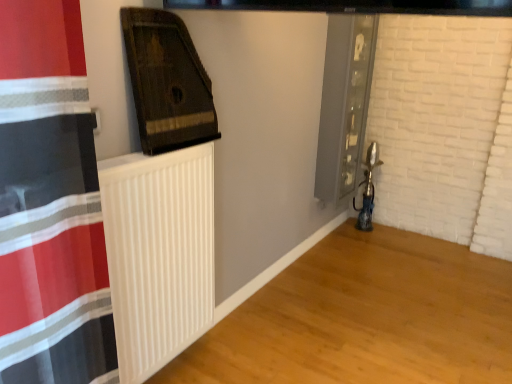
Describe the element at coordinates (159, 254) in the screenshot. I see `white ribbed radiator at center` at that location.

How much space does white matte radiator at lower left, which is counted as the second wood, starting from the left, occupy horizontally?

1.47 meters.

Describe the element at coordinates (356, 101) in the screenshot. I see `metallic glass screen door at right` at that location.

Where is `metallic glass screen door at right`? The image size is (512, 384). metallic glass screen door at right is located at coordinates (356, 101).

What do you see at coordinates (167, 82) in the screenshot? Image resolution: width=512 pixels, height=384 pixels. I see `dark brown wood at upper left, arranged as the 1th wood when viewed from the top` at bounding box center [167, 82].

This screenshot has width=512, height=384. Identify the location of white ribbed radiator at center. (159, 254).

From the image's perspective, which object appears higher, metallic glass screen door at right or dark brown wood at upper left, arranged as the 1th wood when viewed from the top?

From the image's view, metallic glass screen door at right is above.

How different are the orientations of metallic glass screen door at right and dark brown wood at upper left, arranged as the 1th wood when viewed from the top, in degrees?

They differ by 1.64 degrees in their facing directions.

Relative to dark brown wood at upper left, which ranks as the second wood in right-to-left order, is metallic glass screen door at right in front or behind?

Visually, metallic glass screen door at right is located behind dark brown wood at upper left, which ranks as the second wood in right-to-left order.

From a real-world perspective, who is located higher, metallic glass screen door at right or dark brown wood at upper left, placed as the second wood when sorted from bottom to top?

dark brown wood at upper left, placed as the second wood when sorted from bottom to top, from a real-world perspective.

Between white matte radiator at lower left, which ranks as the 2th wood in top-to-bottom order, and white ribbed radiator at center, which one has smaller width?

white ribbed radiator at center is thinner.

Is white matte radiator at lower left, the 1th wood from the bottom, surrounding white ribbed radiator at center?

No.

Considering the relative sizes of white matte radiator at lower left, which ranks as the 2th wood in top-to-bottom order, and white ribbed radiator at center in the image provided, is white matte radiator at lower left, which ranks as the 2th wood in top-to-bottom order, shorter than white ribbed radiator at center?

Correct, white matte radiator at lower left, which ranks as the 2th wood in top-to-bottom order, is not as tall as white ribbed radiator at center.

Consider the image. Can you confirm if white matte radiator at lower left, which ranks as the 2th wood in top-to-bottom order, is smaller than white ribbed radiator at center?

Actually, white matte radiator at lower left, which ranks as the 2th wood in top-to-bottom order, might be larger than white ribbed radiator at center.

Looking at the image, does dark brown wood at upper left, positioned as the first wood in left-to-right order, seem bigger or smaller compared to white matte radiator at lower left, which ranks as the 1th wood in right-to-left order?

Clearly, dark brown wood at upper left, positioned as the first wood in left-to-right order, is smaller in size than white matte radiator at lower left, which ranks as the 1th wood in right-to-left order.

From the picture: Is dark brown wood at upper left, arranged as the 1th wood when viewed from the top, oriented towards white matte radiator at lower left, the 1th wood from the bottom?

No, dark brown wood at upper left, arranged as the 1th wood when viewed from the top, is not facing towards white matte radiator at lower left, the 1th wood from the bottom.

Is dark brown wood at upper left, placed as the second wood when sorted from bottom to top, further to camera compared to white matte radiator at lower left, which is counted as the second wood, starting from the left?

That is True.

Can you tell me how much dark brown wood at upper left, arranged as the 1th wood when viewed from the top, and white matte radiator at lower left, the 1th wood from the bottom, differ in facing direction?

0.342 degrees separate the facing orientations of dark brown wood at upper left, arranged as the 1th wood when viewed from the top, and white matte radiator at lower left, the 1th wood from the bottom.

Looking at this image, could you tell me if white ribbed radiator at center is turned towards dark brown wood at upper left, placed as the second wood when sorted from bottom to top?

No, white ribbed radiator at center is not aimed at dark brown wood at upper left, placed as the second wood when sorted from bottom to top.

From a real-world perspective, does white ribbed radiator at center sit lower than dark brown wood at upper left, placed as the second wood when sorted from bottom to top?

Correct, in the physical world, white ribbed radiator at center is lower than dark brown wood at upper left, placed as the second wood when sorted from bottom to top.

From the image's perspective, which one is positioned higher, white ribbed radiator at center or white matte radiator at lower left, which is counted as the second wood, starting from the left?

white ribbed radiator at center appears higher in the image.

Can you confirm if white ribbed radiator at center is taller than white matte radiator at lower left, the 1th wood from the bottom?

Yes, white ribbed radiator at center is taller than white matte radiator at lower left, the 1th wood from the bottom.

Is white ribbed radiator at center with white matte radiator at lower left, which ranks as the 2th wood in top-to-bottom order?

No, white ribbed radiator at center is not making contact with white matte radiator at lower left, which ranks as the 2th wood in top-to-bottom order.

Is white ribbed radiator at center further to camera compared to white matte radiator at lower left, which ranks as the 1th wood in right-to-left order?

Yes.

Is white ribbed radiator at center looking in the opposite direction of metallic glass screen door at right?

No, white ribbed radiator at center's orientation is not away from metallic glass screen door at right.

Is point (167, 243) positioned after point (354, 145)?

No, it is not.

In terms of width, does white ribbed radiator at center look wider or thinner when compared to metallic glass screen door at right?

In the image, white ribbed radiator at center appears to be more narrow than metallic glass screen door at right.

Can you tell me how much dark brown wood at upper left, which ranks as the second wood in right-to-left order, and metallic glass screen door at right differ in facing direction?

The facing directions of dark brown wood at upper left, which ranks as the second wood in right-to-left order, and metallic glass screen door at right are 1.64 degrees apart.

Based on the photo, is dark brown wood at upper left, placed as the second wood when sorted from bottom to top, inside or outside of metallic glass screen door at right?

dark brown wood at upper left, placed as the second wood when sorted from bottom to top, cannot be found inside metallic glass screen door at right.

Considering the relative sizes of dark brown wood at upper left, arranged as the 1th wood when viewed from the top, and metallic glass screen door at right in the image provided, is dark brown wood at upper left, arranged as the 1th wood when viewed from the top, bigger than metallic glass screen door at right?

Incorrect, dark brown wood at upper left, arranged as the 1th wood when viewed from the top, is not larger than metallic glass screen door at right.

Identify the location of wood that is the 1st one when counting downward from the metallic glass screen door at right (from the image's perspective). The image size is (512, 384). (167, 82).

Identify the location of radiator above the white matte radiator at lower left, which is counted as the second wood, starting from the left (from a real-world perspective). This screenshot has height=384, width=512. (159, 254).

Which object lies further to the anchor point white matte radiator at lower left, which ranks as the 1th wood in right-to-left order, dark brown wood at upper left, positioned as the first wood in left-to-right order, or metallic glass screen door at right?

dark brown wood at upper left, positioned as the first wood in left-to-right order, is positioned further to the anchor white matte radiator at lower left, which ranks as the 1th wood in right-to-left order.

From the image, which object appears to be nearer to white ribbed radiator at center, white matte radiator at lower left, which ranks as the 2th wood in top-to-bottom order, or metallic glass screen door at right?

white matte radiator at lower left, which ranks as the 2th wood in top-to-bottom order, is positioned closer to the anchor white ribbed radiator at center.

Which object lies further to the anchor point white matte radiator at lower left, which is counted as the second wood, starting from the left, white ribbed radiator at center or metallic glass screen door at right?

Among the two, metallic glass screen door at right is located further to white matte radiator at lower left, which is counted as the second wood, starting from the left.

Considering their positions, is white ribbed radiator at center positioned further to dark brown wood at upper left, positioned as the first wood in left-to-right order, than metallic glass screen door at right?

Among the two, metallic glass screen door at right is located further to dark brown wood at upper left, positioned as the first wood in left-to-right order.

Estimate the real-world distances between objects in this image. Which object is closer to white ribbed radiator at center, dark brown wood at upper left, positioned as the first wood in left-to-right order, or metallic glass screen door at right?

The object closer to white ribbed radiator at center is dark brown wood at upper left, positioned as the first wood in left-to-right order.

Looking at the image, which one is located further to dark brown wood at upper left, positioned as the first wood in left-to-right order, metallic glass screen door at right or white ribbed radiator at center?

metallic glass screen door at right.

When comparing their distances from metallic glass screen door at right, does dark brown wood at upper left, which ranks as the second wood in right-to-left order, or white ribbed radiator at center seem further?

Among the two, white ribbed radiator at center is located further to metallic glass screen door at right.

From the image, which object appears to be nearer to white matte radiator at lower left, which ranks as the 2th wood in top-to-bottom order, metallic glass screen door at right or white ribbed radiator at center?

white ribbed radiator at center is closer to white matte radiator at lower left, which ranks as the 2th wood in top-to-bottom order.

Identify the location of wood positioned between white matte radiator at lower left, the 1th wood from the bottom, and metallic glass screen door at right from near to far. (167, 82).

In order to click on radiator located between white matte radiator at lower left, which ranks as the 2th wood in top-to-bottom order, and metallic glass screen door at right in the depth direction in this screenshot , I will do `click(159, 254)`.

At what (x,y) coordinates should I click in order to perform the action: click on wood between white ribbed radiator at center and white matte radiator at lower left, the 1th wood from the bottom, in the horizontal direction. Please return your answer as a coordinate pair (x, y). Looking at the image, I should click on (167, 82).

You are a GUI agent. You are given a task and a screenshot of the screen. Output one action in this format:
    pyautogui.click(x=<x>, y=<y>)
    Task: Click on the wood between white ribbed radiator at center and metallic glass screen door at right from front to back
    This screenshot has height=384, width=512.
    Given the screenshot: What is the action you would take?
    pyautogui.click(x=167, y=82)